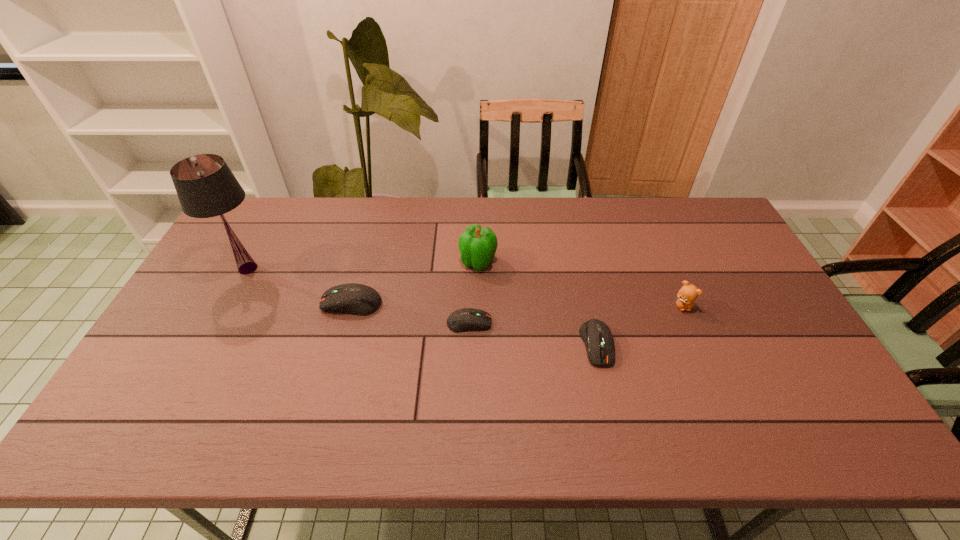
Image resolution: width=960 pixels, height=540 pixels. I want to click on the second object from left to right, so click(x=359, y=299).

I want to click on the second computer equipment from left to right, so click(x=466, y=319).

Identify the location of the shortest object. (466, 319).

You are a GUI agent. You are given a task and a screenshot of the screen. Output one action in this format:
    pyautogui.click(x=<x>, y=<y>)
    Task: Click on the second shortest object
    This screenshot has width=960, height=540.
    Given the screenshot: What is the action you would take?
    pyautogui.click(x=596, y=335)

Locate an element on the screen. the second object from right to left is located at coordinates (596, 335).

Locate an element on the screen. The width and height of the screenshot is (960, 540). bell pepper is located at coordinates (477, 245).

I want to click on the leftmost object, so click(206, 187).

I want to click on lampshade, so click(206, 187).

Identify the location of teddy bear. (688, 293).

I want to click on the rightmost object, so click(688, 293).